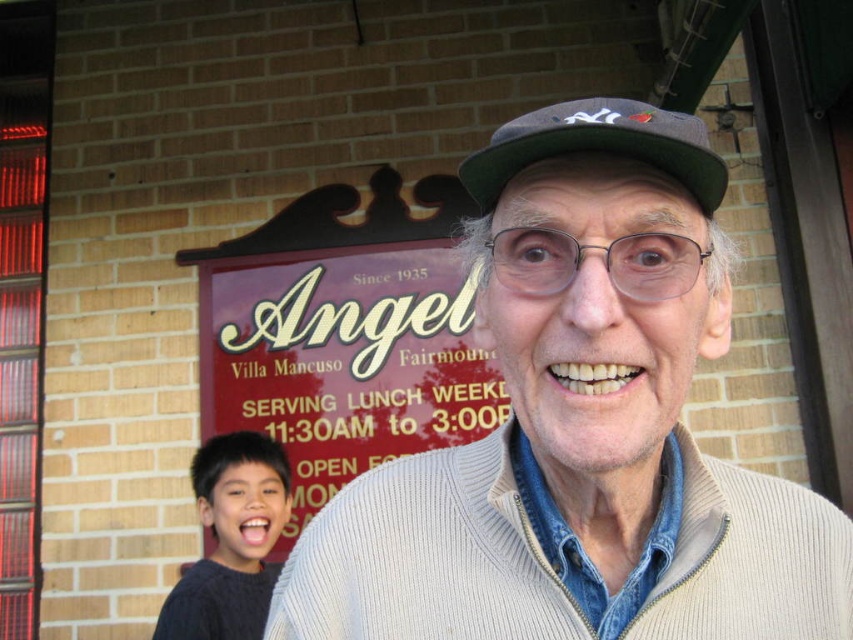
Which is behind, point (223, 273) or point (558, 132)?

Point (223, 273)

Where is `maroon wooden sign at center`? maroon wooden sign at center is located at coordinates (344, 333).

Is white knit sweater at center shorter than maroon wooden sign at center?

Yes, white knit sweater at center is shorter than maroon wooden sign at center.

Which is behind, point (682, 326) or point (323, 282)?

Positioned behind is point (323, 282).

The image size is (853, 640). What do you see at coordinates (581, 428) in the screenshot?
I see `white knit sweater at center` at bounding box center [581, 428].

The width and height of the screenshot is (853, 640). I want to click on white knit sweater at center, so click(581, 428).

Is point (334, 604) less distant than point (218, 611)?

That is True.

Is white ribbed sweater at center smaller than dark gray sweater at lower left?

Indeed, white ribbed sweater at center has a smaller size compared to dark gray sweater at lower left.

Describe the element at coordinates (427, 557) in the screenshot. This screenshot has height=640, width=853. I see `white ribbed sweater at center` at that location.

Where is `white ribbed sweater at center`? Image resolution: width=853 pixels, height=640 pixels. white ribbed sweater at center is located at coordinates (427, 557).